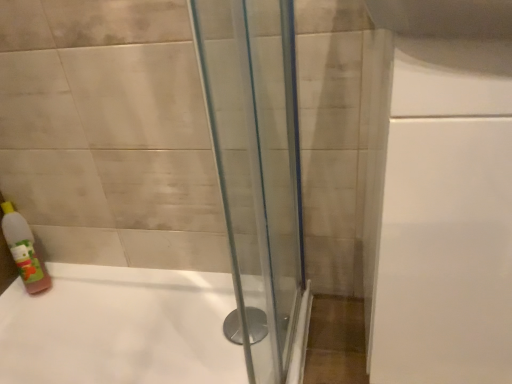
Measure the distance between point (17,262) and camera.

Point (17,262) is 1.26 meters from camera.

The height and width of the screenshot is (384, 512). I want to click on translucent plastic bottle at lower left, so click(24, 250).

Image resolution: width=512 pixels, height=384 pixels. What do you see at coordinates (24, 250) in the screenshot?
I see `translucent plastic bottle at lower left` at bounding box center [24, 250].

Measure the distance between translucent plastic bottle at lower left and camera.

The distance of translucent plastic bottle at lower left from camera is 1.22 meters.

Identify the location of white glossy bathtub at center. The height and width of the screenshot is (384, 512). (120, 328).

The width and height of the screenshot is (512, 384). What do you see at coordinates (120, 328) in the screenshot?
I see `white glossy bathtub at center` at bounding box center [120, 328].

Identify the location of translucent plastic bottle at lower left. (24, 250).

Is translucent plastic bottle at lower left at the left side of white glossy bathtub at center?

Indeed, translucent plastic bottle at lower left is positioned on the left side of white glossy bathtub at center.

Considering the positions of objects translucent plastic bottle at lower left and white glossy bathtub at center in the image provided, who is in front, translucent plastic bottle at lower left or white glossy bathtub at center?

white glossy bathtub at center is in front.

Which is closer, (17, 255) or (9, 376)?

Point (17, 255) is farther from the camera than point (9, 376).

From the image's perspective, is translucent plastic bottle at lower left above or below white glossy bathtub at center?

translucent plastic bottle at lower left is situated higher than white glossy bathtub at center in the image.

From a real-world perspective, is translucent plastic bottle at lower left on white glossy bathtub at center?

Yes, from a real-world perspective, translucent plastic bottle at lower left is over white glossy bathtub at center

In terms of width, does translucent plastic bottle at lower left look wider or thinner when compared to white glossy bathtub at center?

translucent plastic bottle at lower left is thinner than white glossy bathtub at center.

Considering the sizes of translucent plastic bottle at lower left and white glossy bathtub at center in the image, is translucent plastic bottle at lower left taller or shorter than white glossy bathtub at center?

In the image, translucent plastic bottle at lower left appears to be taller than white glossy bathtub at center.

Considering the sizes of objects translucent plastic bottle at lower left and white glossy bathtub at center in the image provided, who is bigger, translucent plastic bottle at lower left or white glossy bathtub at center?

Bigger between the two is white glossy bathtub at center.

Choose the correct answer: Is translucent plastic bottle at lower left inside white glossy bathtub at center or outside it?

translucent plastic bottle at lower left exists outside the volume of white glossy bathtub at center.

Would you say translucent plastic bottle at lower left is a long distance from white glossy bathtub at center?

No, translucent plastic bottle at lower left is not far from white glossy bathtub at center.

Is translucent plastic bottle at lower left oriented towards white glossy bathtub at center?

No, translucent plastic bottle at lower left is not turned towards white glossy bathtub at center.

What's the angular difference between translucent plastic bottle at lower left and white glossy bathtub at center's facing directions?

They differ by 43.3 degrees in their facing directions.

Where is `bathtub on the right of translucent plastic bottle at lower left`? The image size is (512, 384). bathtub on the right of translucent plastic bottle at lower left is located at coordinates (120, 328).

Considering the positions of objects white glossy bathtub at center and translucent plastic bottle at lower left in the image provided, who is more to the left, white glossy bathtub at center or translucent plastic bottle at lower left?

Positioned to the left is translucent plastic bottle at lower left.

In the scene shown: Is white glossy bathtub at center in front of or behind translucent plastic bottle at lower left in the image?

white glossy bathtub at center is in front of translucent plastic bottle at lower left.

Which is further, (x=88, y=270) or (x=16, y=212)?

The point (x=88, y=270) is more distant.

From the image's perspective, would you say white glossy bathtub at center is positioned over translucent plastic bottle at lower left?

No, from the image's perspective, white glossy bathtub at center is not above translucent plastic bottle at lower left.

From a real-world perspective, is white glossy bathtub at center above or below translucent plastic bottle at lower left?

white glossy bathtub at center is situated lower than translucent plastic bottle at lower left in the real world.

Is white glossy bathtub at center wider or thinner than translucent plastic bottle at lower left?

In the image, white glossy bathtub at center appears to be wider than translucent plastic bottle at lower left.

Considering the relative sizes of white glossy bathtub at center and translucent plastic bottle at lower left in the image provided, is white glossy bathtub at center taller than translucent plastic bottle at lower left?

Incorrect, the height of white glossy bathtub at center is not larger of that of translucent plastic bottle at lower left.

Considering the relative sizes of white glossy bathtub at center and translucent plastic bottle at lower left in the image provided, is white glossy bathtub at center smaller than translucent plastic bottle at lower left?

No.

Is white glossy bathtub at center located outside translucent plastic bottle at lower left?

Yes, white glossy bathtub at center is not within translucent plastic bottle at lower left.

Is the surface of white glossy bathtub at center in direct contact with translucent plastic bottle at lower left?

No, white glossy bathtub at center is not making contact with translucent plastic bottle at lower left.

Does white glossy bathtub at center turn towards translucent plastic bottle at lower left?

No, white glossy bathtub at center is not aimed at translucent plastic bottle at lower left.

Can you tell me how much white glossy bathtub at center and translucent plastic bottle at lower left differ in facing direction?

white glossy bathtub at center and translucent plastic bottle at lower left are facing 43.3 degrees away from each other.

The height and width of the screenshot is (384, 512). Find the location of `bathtub in front of the translucent plastic bottle at lower left`. bathtub in front of the translucent plastic bottle at lower left is located at coordinates (120, 328).

This screenshot has height=384, width=512. I want to click on bathtub located on the right of translucent plastic bottle at lower left, so click(x=120, y=328).

At what (x,y) coordinates should I click in order to perform the action: click on bathtub that appears below the translucent plastic bottle at lower left (from the image's perspective). Please return your answer as a coordinate pair (x, y). The height and width of the screenshot is (384, 512). Looking at the image, I should click on (120, 328).